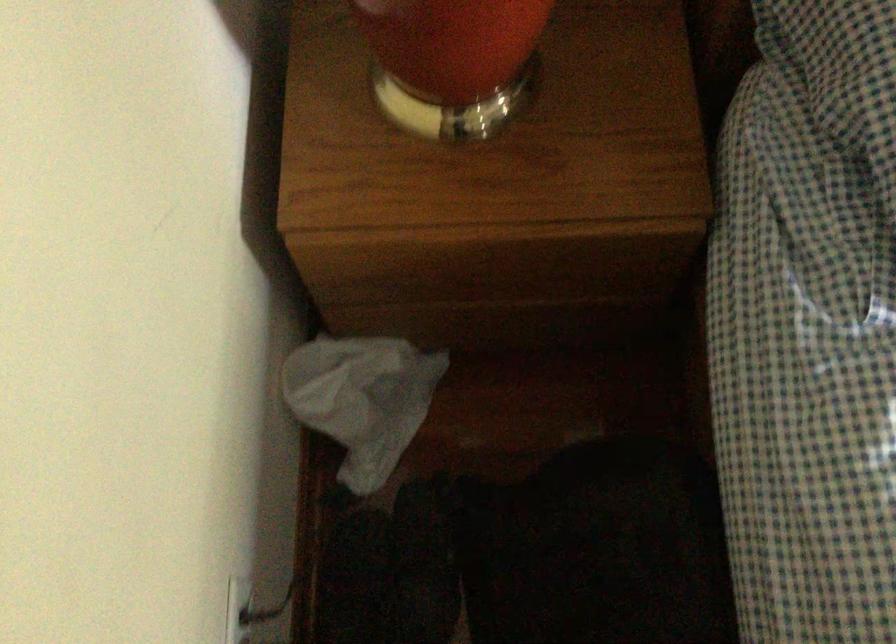
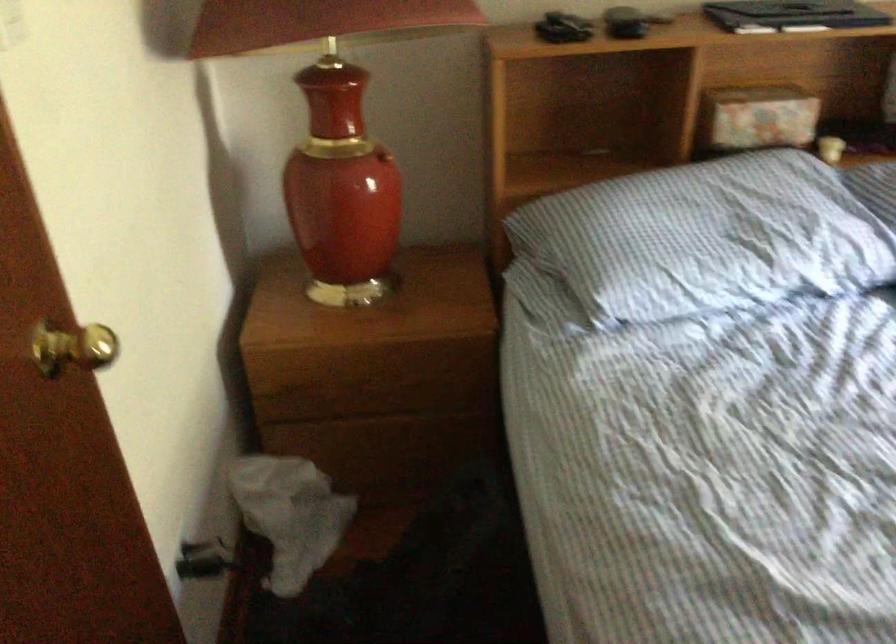
Find the pixel in the second image that matches the point at 367,418 in the first image.

(289, 515)